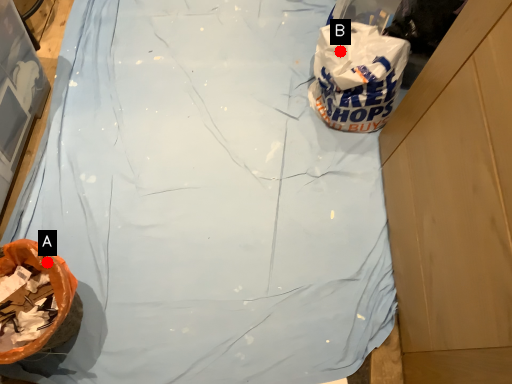
Question: Two points are circled on the image, labeled by A and B beside each circle. Which of the following is the farthest from the observer?

Choices:
 (A) A is further
 (B) B is further

Answer: (B)